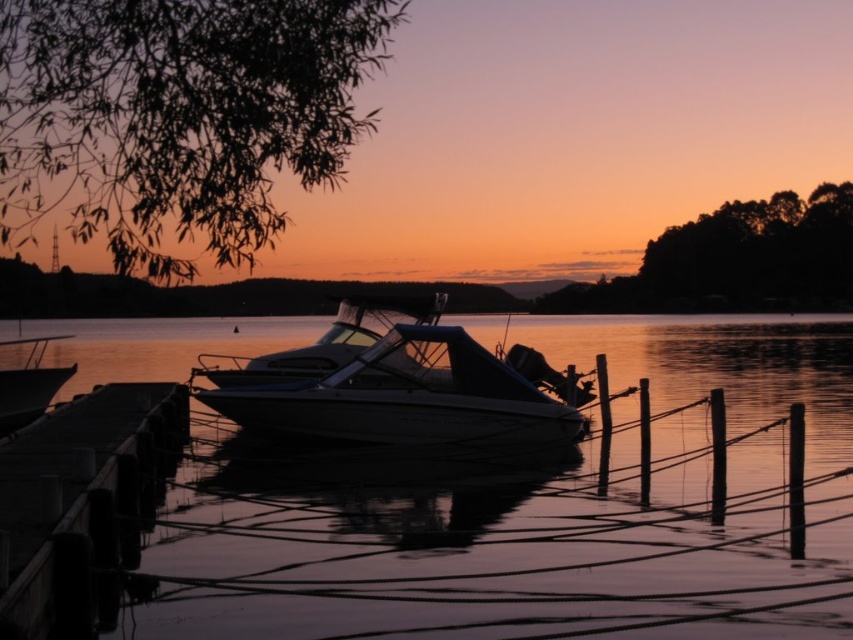
Between point (827, 342) and point (50, 595), which one is positioned in front?

Point (50, 595) is in front.

Can you confirm if glossy water at center is thinner than smooth wood dock at lower left?

In fact, glossy water at center might be wider than smooth wood dock at lower left.

Is point (289, 618) positioned behind point (47, 444)?

No, (289, 618) is closer to viewer.

The image size is (853, 640). In order to click on glossy water at center in this screenshot , I will do `click(540, 515)`.

Based on the photo, can you confirm if glossy water at center is bigger than matte white boat at left?

Correct, glossy water at center is larger in size than matte white boat at left.

Does point (636, 548) come farther from viewer compared to point (48, 401)?

No, (636, 548) is closer to viewer.

Between point (337, 592) and point (36, 388), which one is positioned in front?

Point (337, 592)

Where is `glossy water at center`? glossy water at center is located at coordinates (540, 515).

Who is positioned more to the left, white glossy boat at center or smooth wood dock at lower left?

Positioned to the left is smooth wood dock at lower left.

Is white glossy boat at center thinner than smooth wood dock at lower left?

Yes, white glossy boat at center is thinner than smooth wood dock at lower left.

Is point (541, 376) positioned in front of point (115, 600)?

No, it is not.

You are a GUI agent. You are given a task and a screenshot of the screen. Output one action in this format:
    pyautogui.click(x=<x>, y=<y>)
    Task: Click on the white glossy boat at center
    Image resolution: width=853 pixels, height=640 pixels.
    Given the screenshot: What is the action you would take?
    pyautogui.click(x=399, y=385)